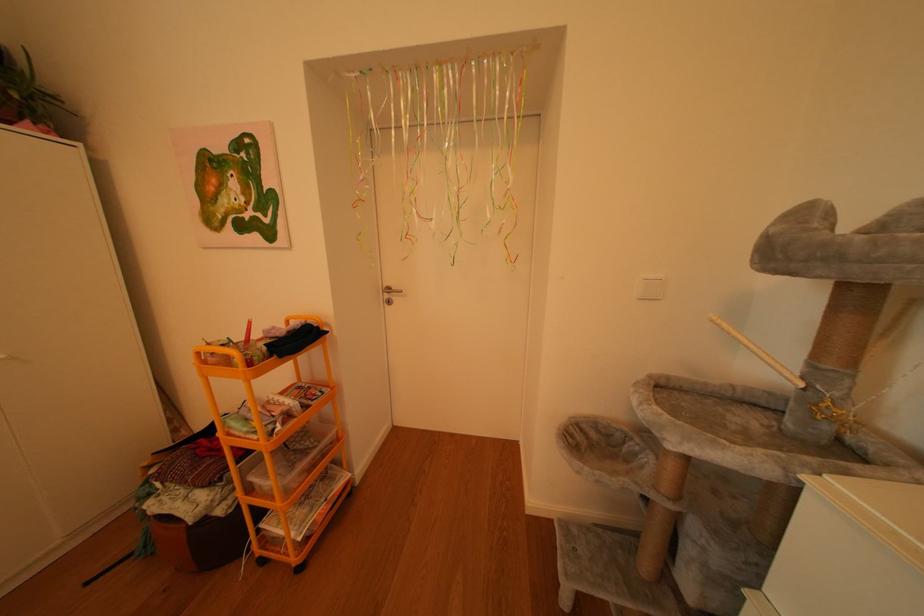
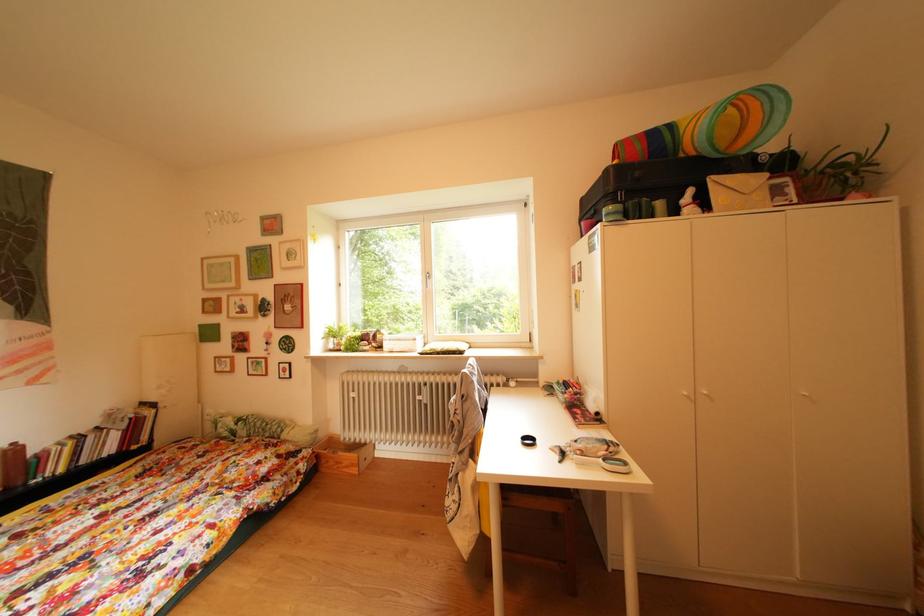
Question: The images are taken continuously from a first-person perspective. In which direction is your viewpoint rotating?

Choices:
 (A) Left
 (B) Right
 (C) Up
 (D) Down

Answer: (A)